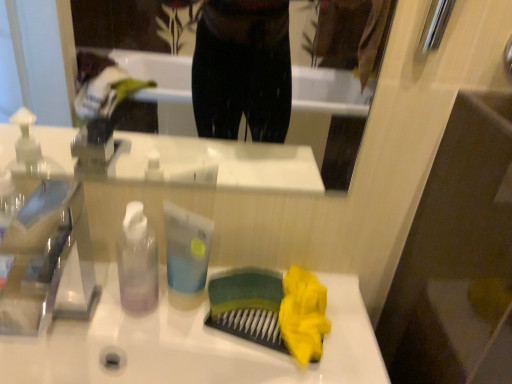
Question: Is translucent plastic bottle at center further to camera compared to transparent plastic faucet at left?

Choices:
 (A) no
 (B) yes

Answer: (B)

Question: From the image's perspective, is translucent plastic bottle at center below transparent plastic faucet at left?

Choices:
 (A) yes
 (B) no

Answer: (A)

Question: Is translucent plastic bottle at center closer to camera compared to transparent plastic faucet at left?

Choices:
 (A) no
 (B) yes

Answer: (A)

Question: Is translucent plastic bottle at center beside transparent plastic faucet at left?

Choices:
 (A) no
 (B) yes

Answer: (A)

Question: From a real-world perspective, is translucent plastic bottle at center physically below transparent plastic faucet at left?

Choices:
 (A) no
 (B) yes

Answer: (B)

Question: Choose the correct answer: Is translucent plastic bottle at center inside transparent plastic faucet at left or outside it?

Choices:
 (A) inside
 (B) outside

Answer: (B)

Question: Is translucent plastic bottle at center to the left or to the right of transparent plastic faucet at left in the image?

Choices:
 (A) left
 (B) right

Answer: (B)

Question: From a real-world perspective, relative to transparent plastic faucet at left, is translucent plastic bottle at center vertically above or below?

Choices:
 (A) above
 (B) below

Answer: (B)

Question: Is point (181, 248) positioned closer to the camera than point (71, 236)?

Choices:
 (A) farther
 (B) closer

Answer: (B)

Question: Is transparent plastic faucet at left wider or thinner than translucent plastic bottle at center?

Choices:
 (A) wide
 (B) thin

Answer: (A)

Question: Is transparent plastic faucet at left taller or shorter than translucent plastic bottle at center?

Choices:
 (A) tall
 (B) short

Answer: (A)

Question: From the image's perspective, is transparent plastic faucet at left above or below translucent plastic bottle at center?

Choices:
 (A) below
 (B) above

Answer: (B)

Question: Is transparent plastic faucet at left to the left or to the right of translucent plastic bottle at center in the image?

Choices:
 (A) right
 (B) left

Answer: (B)

Question: Is point (203, 231) positioned closer to the camera than point (131, 220)?

Choices:
 (A) farther
 (B) closer

Answer: (A)

Question: From a real-world perspective, is translucent plastic bottle at center above or below transparent plastic bottle at center?

Choices:
 (A) below
 (B) above

Answer: (A)